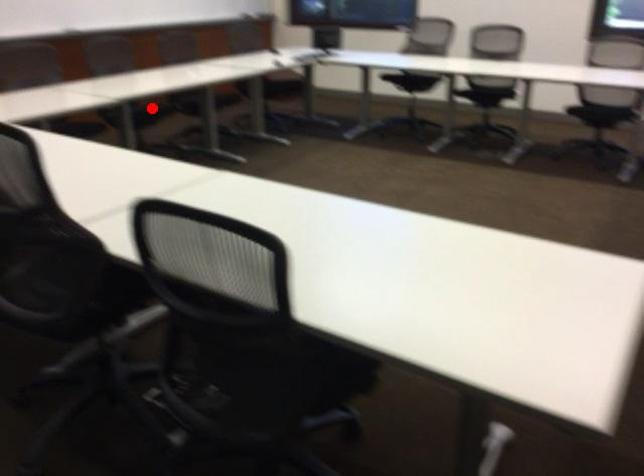
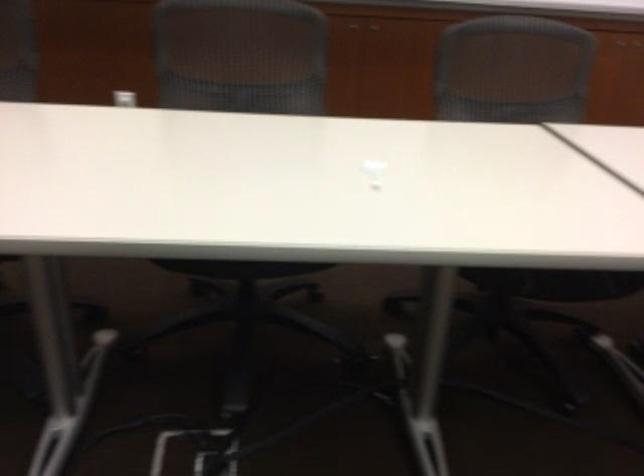
Question: I am providing you with two images of the same scene from different viewpoints. In image1, a red point is highlighted. Considering the same 3D point in image2, which of the following is correct?

Choices:
 (A) It is closer
 (B) It is farther

Answer: (A)